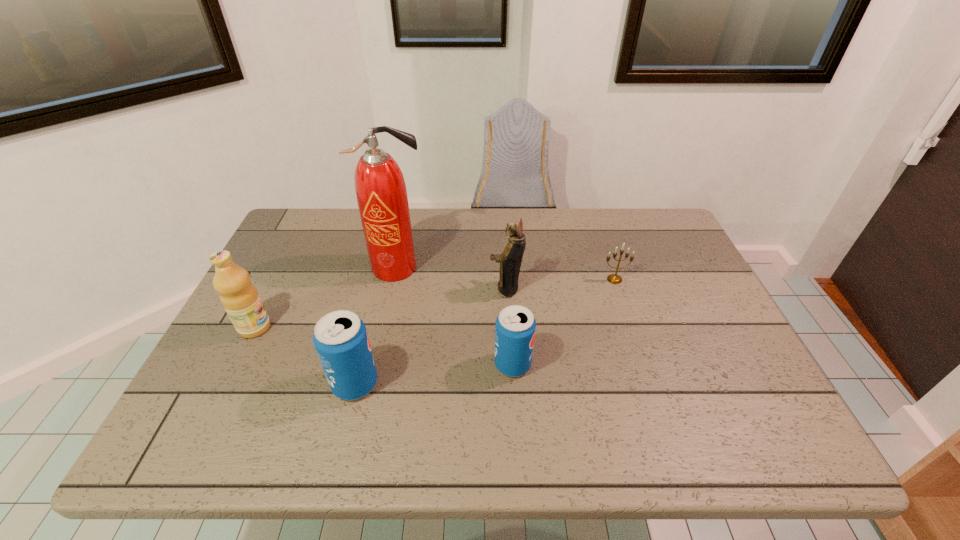
Locate an element on the screen. This screenshot has height=540, width=960. vacant point located between the leftmost object and the shortest object is located at coordinates (435, 303).

Identify the location of free spot between the shorter soda can and the leftmost object. This screenshot has height=540, width=960. (384, 346).

Where is `free space between the rightmost object and the fourth farthest object`? The width and height of the screenshot is (960, 540). free space between the rightmost object and the fourth farthest object is located at coordinates (435, 303).

Point out which object is positioned as the fifth nearest to the rightmost object. Please provide its 2D coordinates. Your answer should be formatted as a tuple, i.e. [(x, y)], where the tuple contains the x and y coordinates of a point satisfying the conditions above.

[(240, 298)]

Where is `the fifth closest object to the figurine`? The height and width of the screenshot is (540, 960). the fifth closest object to the figurine is located at coordinates point(240,298).

The height and width of the screenshot is (540, 960). I want to click on free location that satisfies the following two spatial constraints: 1. on the front side of the rightmost object; 2. on the front-facing side of the figurine, so tap(617, 288).

You are a GUI agent. You are given a task and a screenshot of the screen. Output one action in this format:
    pyautogui.click(x=<x>, y=<y>)
    Task: Click on the free space that satisfies the following two spatial constraints: 1. on the back side of the shorter soda can; 2. on the front-facing side of the figurine
    The width and height of the screenshot is (960, 540).
    Given the screenshot: What is the action you would take?
    pyautogui.click(x=508, y=288)

Find the location of a particular element. blank space that satisfies the following two spatial constraints: 1. on the back side of the shorter soda can; 2. on the front-facing side of the figurine is located at coordinates (508, 288).